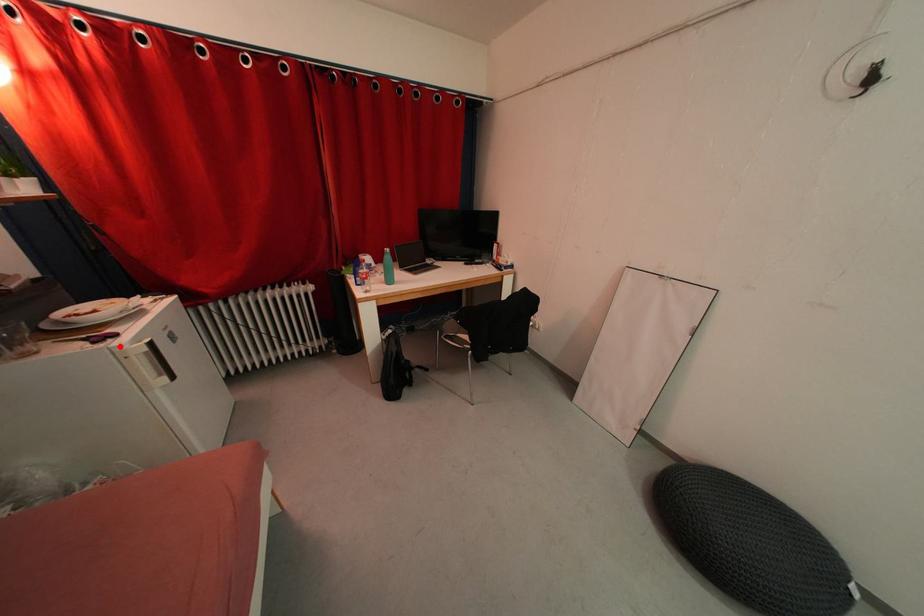
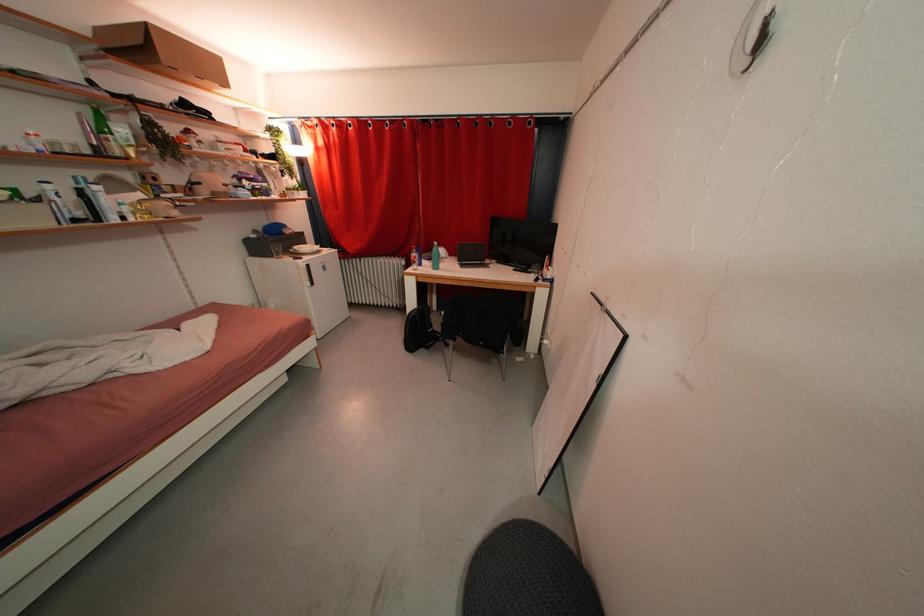
Question: I am providing you with two images of the same scene from different viewpoints. Image1 has a red point marked. In image2, the corresponding 3D location appears at what relative position? Reply with the corresponding letter.

Choices:
 (A) Closer
 (B) Farther

Answer: (A)